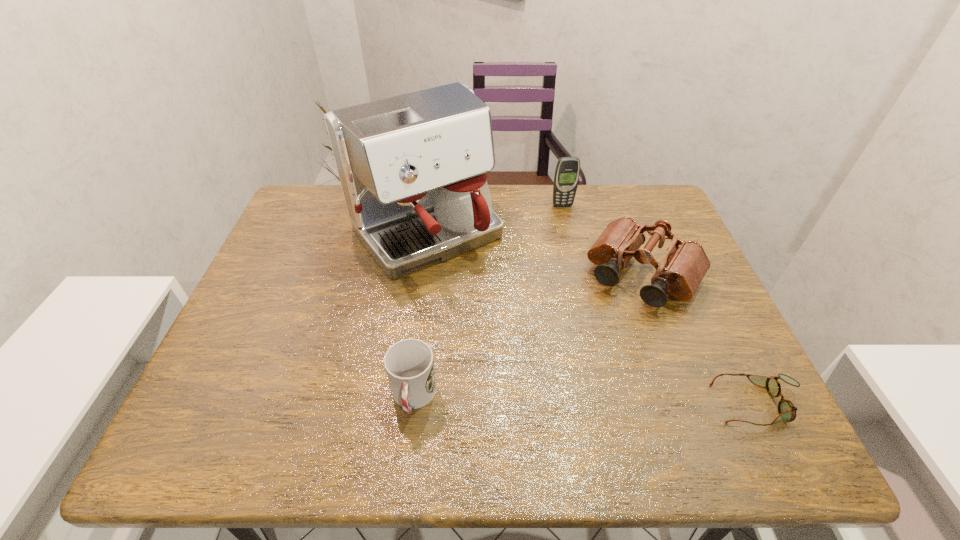
The image size is (960, 540). I want to click on vacant point located 0.240m on the screen of the fourth shortest object, so click(582, 260).

The height and width of the screenshot is (540, 960). I want to click on vacant space located 0.070m through the eyepieces of the binoculars, so click(608, 328).

This screenshot has width=960, height=540. Identify the location of vacant space situated through the eyepieces of the binoculars. (595, 347).

Where is `vacant area situated through the eyepieces of the binoculars`? vacant area situated through the eyepieces of the binoculars is located at coordinates (566, 392).

Find the location of a particular element. The image size is (960, 540). free space located 0.050m on the front of the tallest object near the spout is located at coordinates pyautogui.click(x=472, y=290).

The height and width of the screenshot is (540, 960). I want to click on vacant region located 0.400m on the front of the tallest object near the spout, so click(x=557, y=396).

The width and height of the screenshot is (960, 540). Identify the location of vacant space located 0.170m on the front of the tallest object near the spout. (497, 322).

This screenshot has width=960, height=540. I want to click on cellular telephone present at the far edge, so (x=567, y=172).

This screenshot has width=960, height=540. In order to click on coffee maker at the far edge in this screenshot , I will do `click(412, 167)`.

Find the location of a particular element. This screenshot has height=540, width=960. cup that is positioned at the near edge is located at coordinates (409, 364).